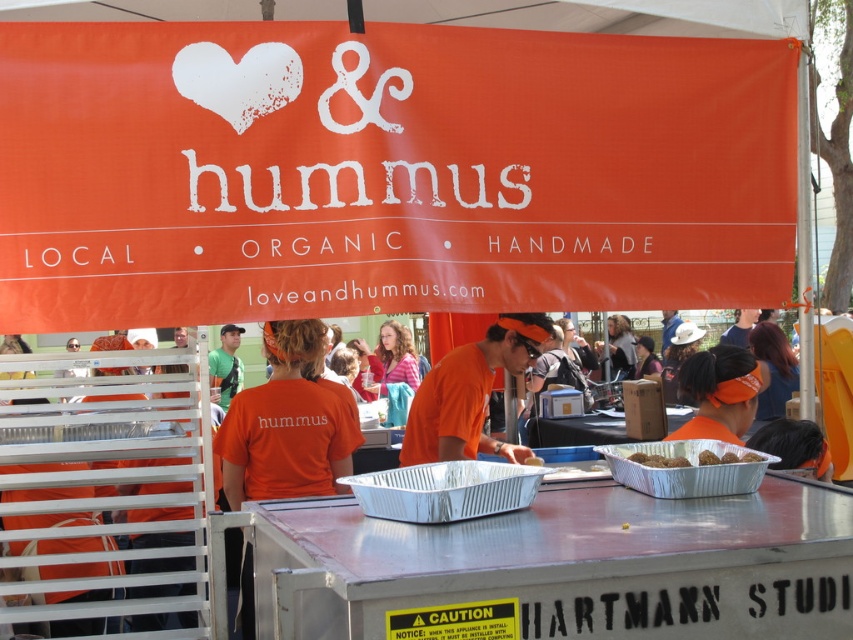
Does orange fabric canopy at upper center lie in front of brown matte meatballs at center?

That is False.

Between orange fabric canopy at upper center and brown matte meatballs at center, which one appears on the left side from the viewer's perspective?

From the viewer's perspective, orange fabric canopy at upper center appears more on the left side.

Between point (730, 228) and point (749, 461), which one is positioned in front?

Point (749, 461) is more forward.

You are a GUI agent. You are given a task and a screenshot of the screen. Output one action in this format:
    pyautogui.click(x=<x>, y=<y>)
    Task: Click on the orange fabric canopy at upper center
    Image resolution: width=853 pixels, height=640 pixels.
    Given the screenshot: What is the action you would take?
    pyautogui.click(x=398, y=163)

Is orange fabric canopy at upper center bigger than orange fabric shirt at center?

Yes.

Between orange fabric canopy at upper center and orange fabric shirt at center, which one is positioned lower?

orange fabric shirt at center

What are the coordinates of `orange fabric canopy at upper center` in the screenshot? It's located at [398, 163].

This screenshot has width=853, height=640. In order to click on orange fabric canopy at upper center in this screenshot , I will do `click(398, 163)`.

Between orange fabric shirt at center and brown matte balls at center, which one has more height?

orange fabric shirt at center

Between point (454, 353) and point (637, 460), which one is positioned behind?

Positioned behind is point (454, 353).

The image size is (853, 640). What are the coordinates of `orange fabric shirt at center` in the screenshot? It's located at (471, 394).